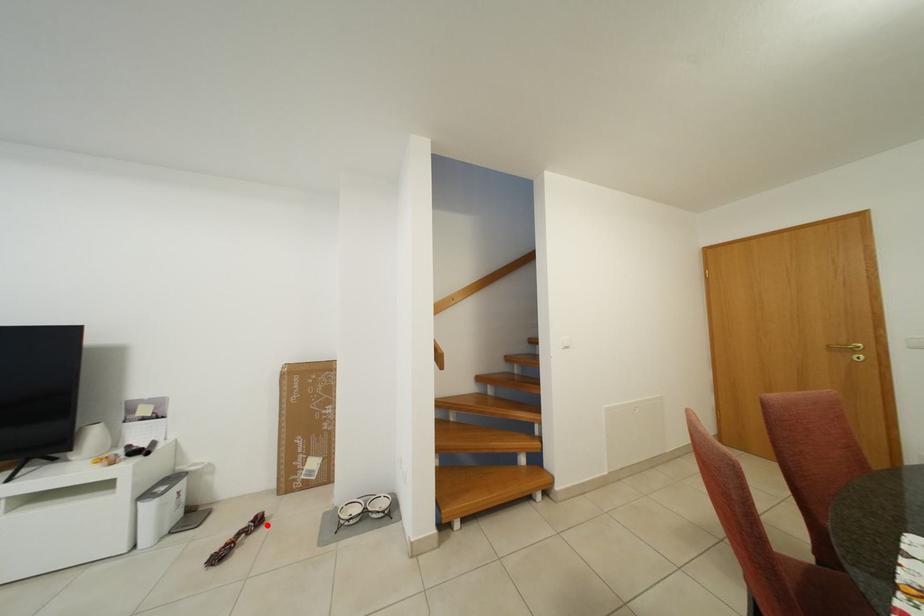
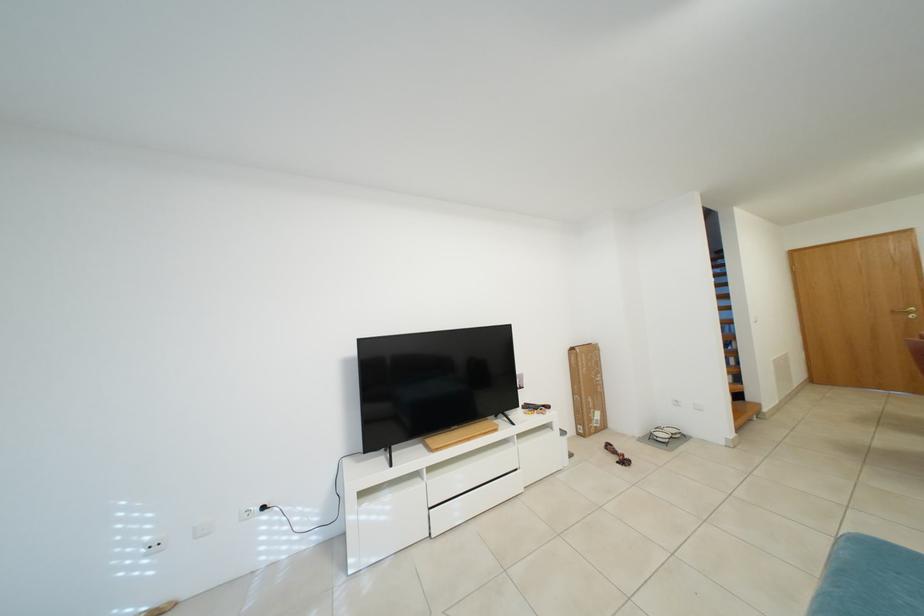
Where in the second image is the point corresponding to the highlighted location from the first image?

(617, 451)